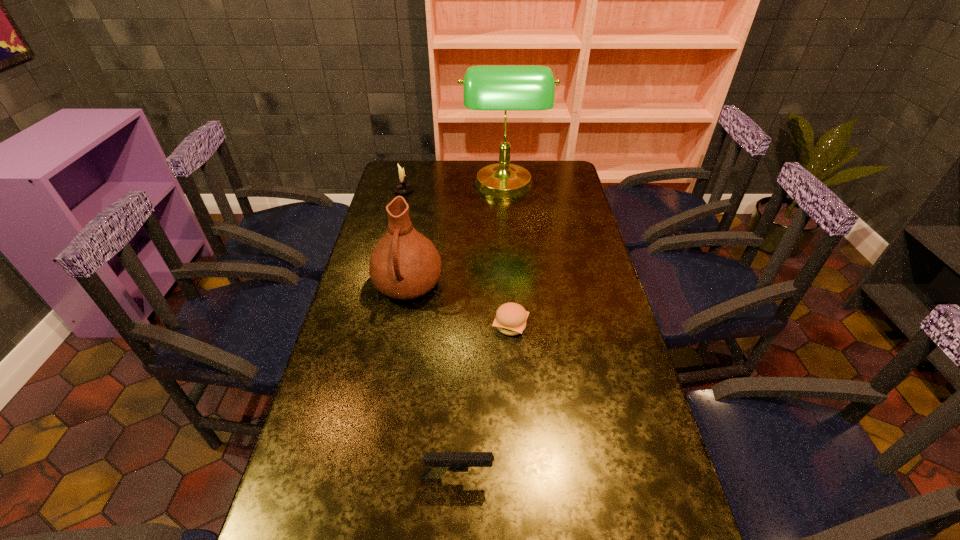
At what (x,y) coordinates should I click in order to perform the action: click on vacant area at the far edge. Please return your answer as a coordinate pair (x, y). The width and height of the screenshot is (960, 540). Looking at the image, I should click on (445, 173).

Where is `free space at the left edge of the desktop`? The image size is (960, 540). free space at the left edge of the desktop is located at coordinates (410, 207).

Find the location of `vacant space at the right edge of the desktop`. vacant space at the right edge of the desktop is located at coordinates (622, 333).

Locate an element on the screen. This screenshot has width=960, height=540. free space between the candle holder and the hamburger is located at coordinates (457, 258).

Image resolution: width=960 pixels, height=540 pixels. Identify the location of vacant space in between the candle holder and the pistol. (430, 334).

Image resolution: width=960 pixels, height=540 pixels. In order to click on vacant area that lies between the hamburger and the lamp in this screenshot , I will do `click(507, 256)`.

Find the location of `vacant area between the second tallest object and the second shortest object`. vacant area between the second tallest object and the second shortest object is located at coordinates (433, 382).

Locate which object is the third closest to the pitcher. Please provide its 2D coordinates. Your answer should be formatted as a tuple, i.e. [(x, y)], where the tuple contains the x and y coordinates of a point satisfying the conditions above.

[(402, 188)]

The image size is (960, 540). Identify the location of object that can be found as the fourth closest to the candle holder. (438, 463).

Where is `free space that satisfies the following two spatial constraints: 1. on the side of the fourth shortest object with the handle; 2. on the left side of the hamburger`? The image size is (960, 540). free space that satisfies the following two spatial constraints: 1. on the side of the fourth shortest object with the handle; 2. on the left side of the hamburger is located at coordinates (401, 326).